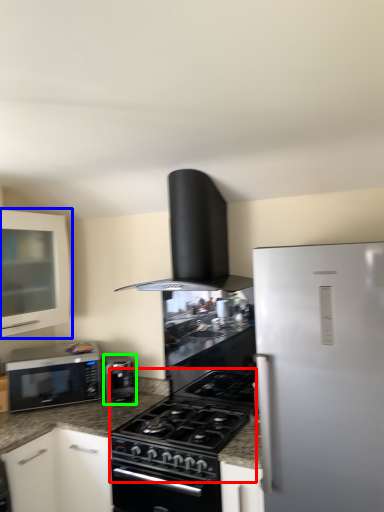
Question: Which object is the closest to the gas stove (highlighted by a red box)? Choose among these: cabinetry (highlighted by a blue box) or kitchen appliance (highlighted by a green box).

Choices:
 (A) cabinetry
 (B) kitchen appliance

Answer: (B)